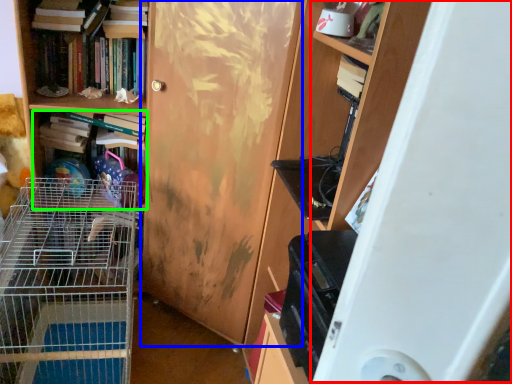
Question: Considering the real-world distances, which object is farthest from wide (highlighted by a red box)? door (highlighted by a blue box) or book (highlighted by a green box)?

Choices:
 (A) door
 (B) book

Answer: (B)